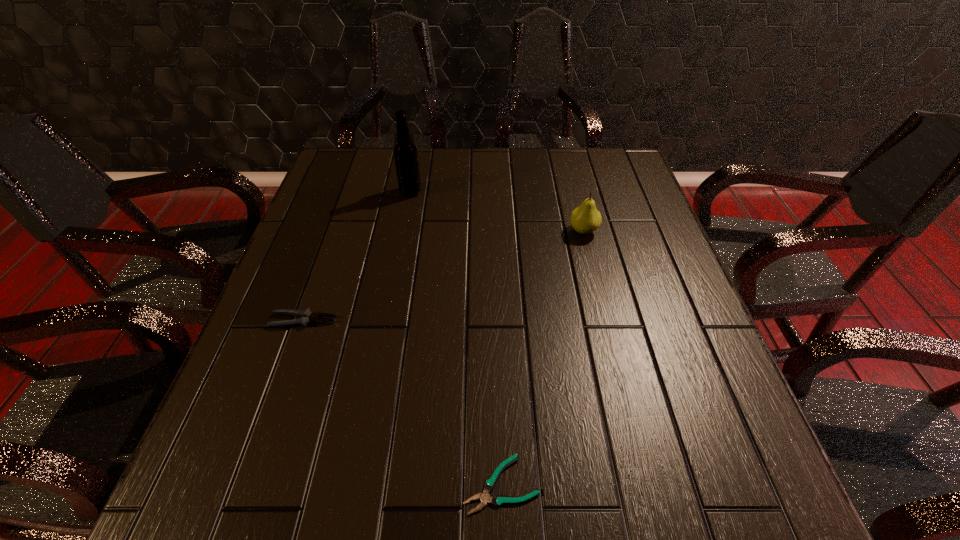
Where is `vacant space that satisfies the following two spatial constraints: 1. on the front side of the second tallest object; 2. at the gripping part of the second nearest object`? The image size is (960, 540). vacant space that satisfies the following two spatial constraints: 1. on the front side of the second tallest object; 2. at the gripping part of the second nearest object is located at coordinates (606, 320).